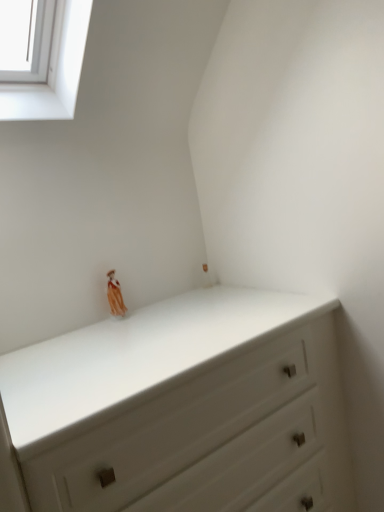
Question: From the image's perspective, is matte orange figurine at upper center below white matte chest of drawers at center?

Choices:
 (A) no
 (B) yes

Answer: (A)

Question: Does matte orange figurine at upper center appear on the left side of white matte chest of drawers at center?

Choices:
 (A) no
 (B) yes

Answer: (B)

Question: From a real-world perspective, is matte orange figurine at upper center located beneath white matte chest of drawers at center?

Choices:
 (A) yes
 (B) no

Answer: (B)

Question: From the image's perspective, is matte orange figurine at upper center on top of white matte chest of drawers at center?

Choices:
 (A) yes
 (B) no

Answer: (A)

Question: Can white matte chest of drawers at center be found inside matte orange figurine at upper center?

Choices:
 (A) yes
 (B) no

Answer: (B)

Question: Is point (110, 273) positioned closer to the camera than point (210, 505)?

Choices:
 (A) farther
 (B) closer

Answer: (A)

Question: Is matte orange figurine at upper center taller or shorter than white matte chest of drawers at center?

Choices:
 (A) short
 (B) tall

Answer: (A)

Question: From a real-world perspective, is matte orange figurine at upper center above or below white matte chest of drawers at center?

Choices:
 (A) below
 (B) above

Answer: (B)

Question: Relative to white matte chest of drawers at center, is matte orange figurine at upper center in front or behind?

Choices:
 (A) behind
 (B) front

Answer: (A)

Question: Considering the positions of white matte chest of drawers at center and white glass window at upper left in the image, is white matte chest of drawers at center wider or thinner than white glass window at upper left?

Choices:
 (A) wide
 (B) thin

Answer: (B)

Question: Is white matte chest of drawers at center inside or outside of white glass window at upper left?

Choices:
 (A) outside
 (B) inside

Answer: (A)

Question: From the image's perspective, relative to white glass window at upper left, is white matte chest of drawers at center above or below?

Choices:
 (A) below
 (B) above

Answer: (A)

Question: Considering the positions of white matte chest of drawers at center and white glass window at upper left in the image, is white matte chest of drawers at center taller or shorter than white glass window at upper left?

Choices:
 (A) short
 (B) tall

Answer: (B)

Question: In the image, is white glass window at upper left positioned in front of or behind matte orange figurine at upper center?

Choices:
 (A) front
 (B) behind

Answer: (A)

Question: From a real-world perspective, is white glass window at upper left positioned above or below matte orange figurine at upper center?

Choices:
 (A) above
 (B) below

Answer: (A)